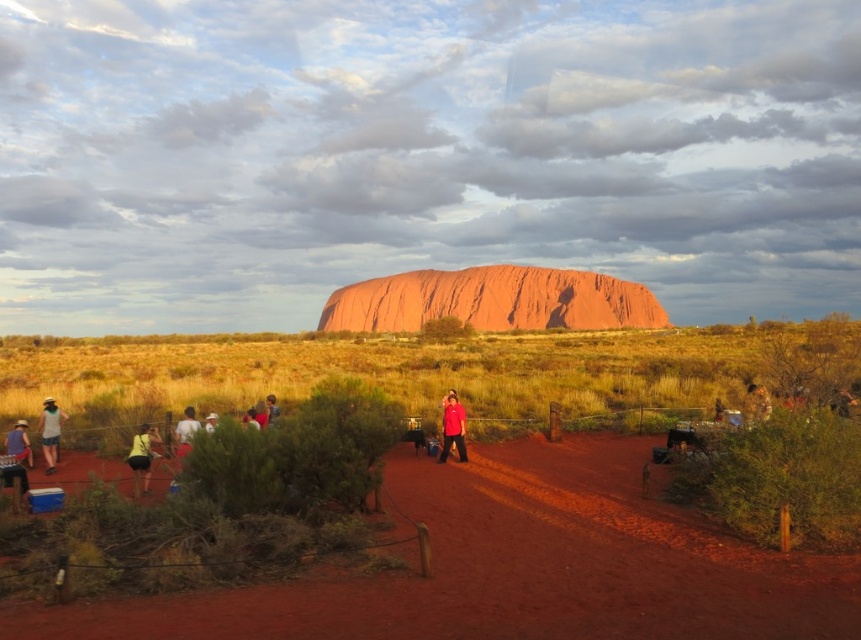
Is point (271, 385) positioned after point (147, 486)?

Yes.

Is point (273, 429) closer to viewer compared to point (152, 435)?

Yes.

Image resolution: width=861 pixels, height=640 pixels. Identify the location of red rock desert at center. (426, 500).

Who is taller, red rock desert at center or light brown fabric shirt at lower left?

red rock desert at center

Describe the element at coordinates (426, 500) in the screenshot. Image resolution: width=861 pixels, height=640 pixels. I see `red rock desert at center` at that location.

Is point (122, 602) positioned in front of point (191, 410)?

Yes, it is in front of point (191, 410).

Identify the location of red rock desert at center. This screenshot has width=861, height=640. (426, 500).

Is matte white shirt at left positioned behind white cotton hat at center?

Yes, it is behind white cotton hat at center.

Consider the image. Can you confirm if matte white shirt at left is positioned to the right of white cotton hat at center?

Incorrect, matte white shirt at left is not on the right side of white cotton hat at center.

Does point (46, 403) come behind point (209, 429)?

Yes, point (46, 403) is behind point (209, 429).

I want to click on matte white shirt at left, so click(x=50, y=432).